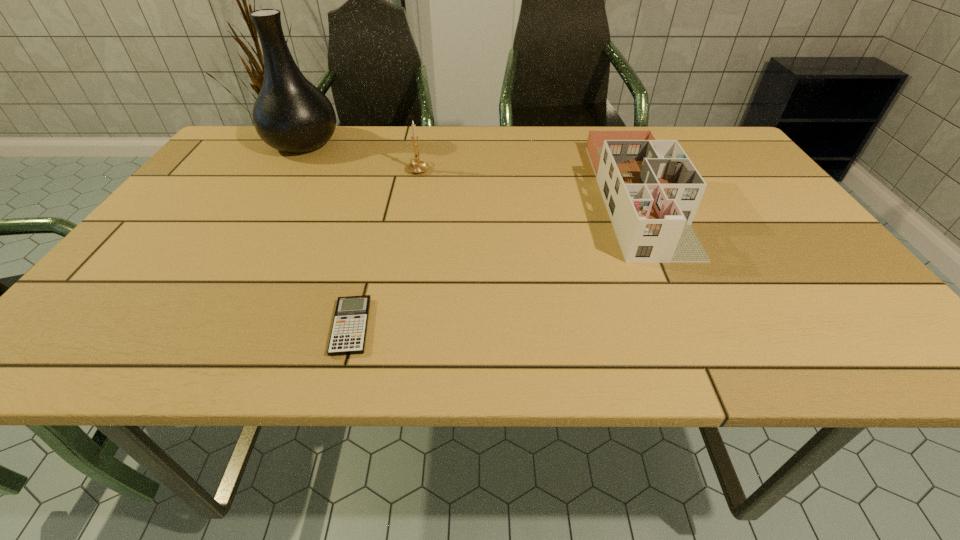
You are a GUI agent. You are given a task and a screenshot of the screen. Output one action in this format:
    pyautogui.click(x=<x>, y=<y>)
    Task: Click on the vacant space at the far edge
    This screenshot has width=960, height=540.
    Given the screenshot: What is the action you would take?
    pyautogui.click(x=560, y=140)

In the image, there is a desktop. Identify the location of vacant space at the near edge. (714, 336).

Find the location of a particular element. This screenshot has width=960, height=540. vacant area at the left edge is located at coordinates (226, 175).

This screenshot has height=540, width=960. What are the coordinates of `free space at the near left corner` in the screenshot? It's located at (49, 362).

In the image, there is a desktop. In order to click on vacant space at the far right corner in this screenshot , I will do `click(714, 148)`.

The image size is (960, 540). Identify the location of vacant space at the near right corner of the desktop. (868, 334).

Locate an element on the screen. This screenshot has height=540, width=960. empty space between the candle holder and the nearest object is located at coordinates (385, 247).

Locate an element on the screen. The width and height of the screenshot is (960, 540). empty location between the nearest object and the second shortest object is located at coordinates (494, 261).

Where is `free spot between the dollhouse and the second tallest object`? free spot between the dollhouse and the second tallest object is located at coordinates (528, 183).

I want to click on unoccupied area between the second object from right to left and the tallest object, so click(x=361, y=156).